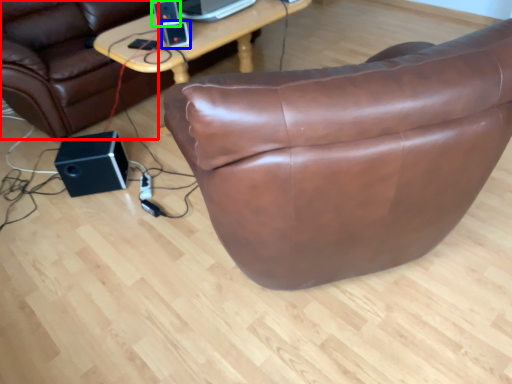
Question: Considering the real-world distances, which object is closest to bean bag chair (highlighted by a red box)? ipod (highlighted by a blue box) or speaker (highlighted by a green box).

Choices:
 (A) ipod
 (B) speaker

Answer: (B)